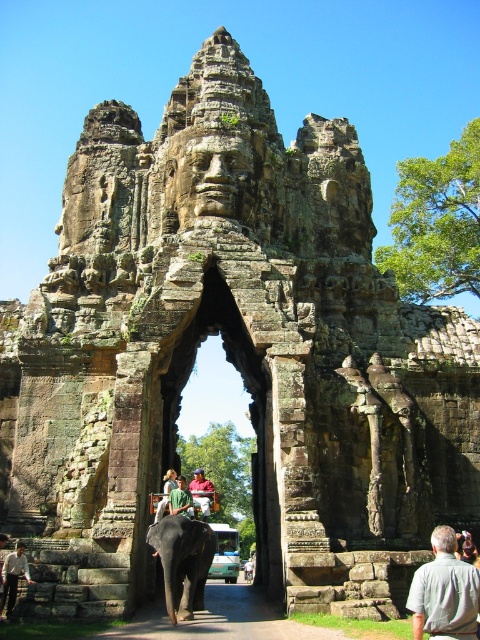
Who is shorter, gray textured elephant at center or light brown leather jacket at lower left?

Standing shorter between the two is light brown leather jacket at lower left.

Can you confirm if gray textured elephant at center is smaller than light brown leather jacket at lower left?

No, gray textured elephant at center is not smaller than light brown leather jacket at lower left.

Where is `gray textured elephant at center`? gray textured elephant at center is located at coordinates (182, 561).

Can you confirm if gray textured elephant at center is positioned below light brown leather hat at center?

Correct, gray textured elephant at center is located below light brown leather hat at center.

Does gray textured elephant at center appear on the left side of light brown leather hat at center?

In fact, gray textured elephant at center is to the right of light brown leather hat at center.

The width and height of the screenshot is (480, 640). What do you see at coordinates (182, 561) in the screenshot? I see `gray textured elephant at center` at bounding box center [182, 561].

In order to click on gray textured elephant at center in this screenshot , I will do point(182,561).

Between point (269, 614) and point (465, 588), which one is positioned behind?

Point (269, 614)

Who is lower down, brown stone path at center or gray fabric shirt at lower right?

Positioned lower is brown stone path at center.

You are a GUI agent. You are given a task and a screenshot of the screen. Output one action in this format:
    pyautogui.click(x=<x>, y=<y>)
    Task: Click on the brown stone path at center
    The height and width of the screenshot is (640, 480).
    Given the screenshot: What is the action you would take?
    pyautogui.click(x=219, y=620)